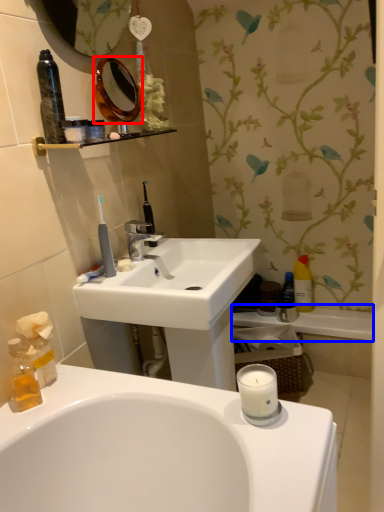
Question: Which point is closer to the camera, mirror (highlighted by a red box) or bath (highlighted by a blue box)?

Choices:
 (A) mirror
 (B) bath

Answer: (A)